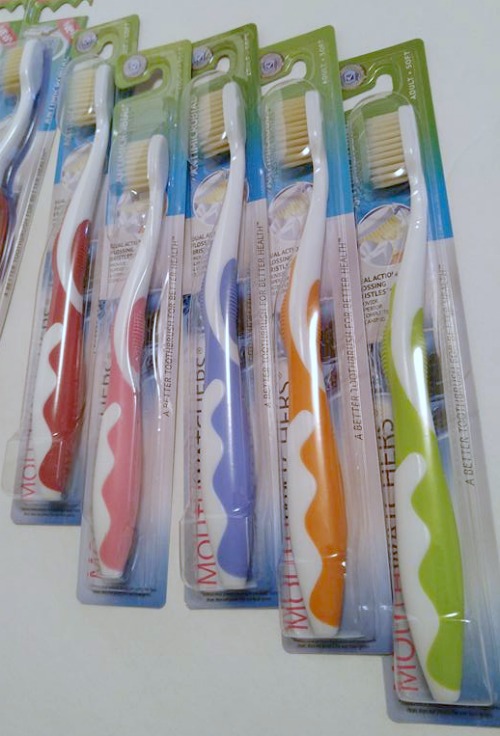
The height and width of the screenshot is (736, 500). Identify the location of head of toothbrush. point(34,63), point(100,91), point(158,163), point(231,110), point(311,102), point(412,149).